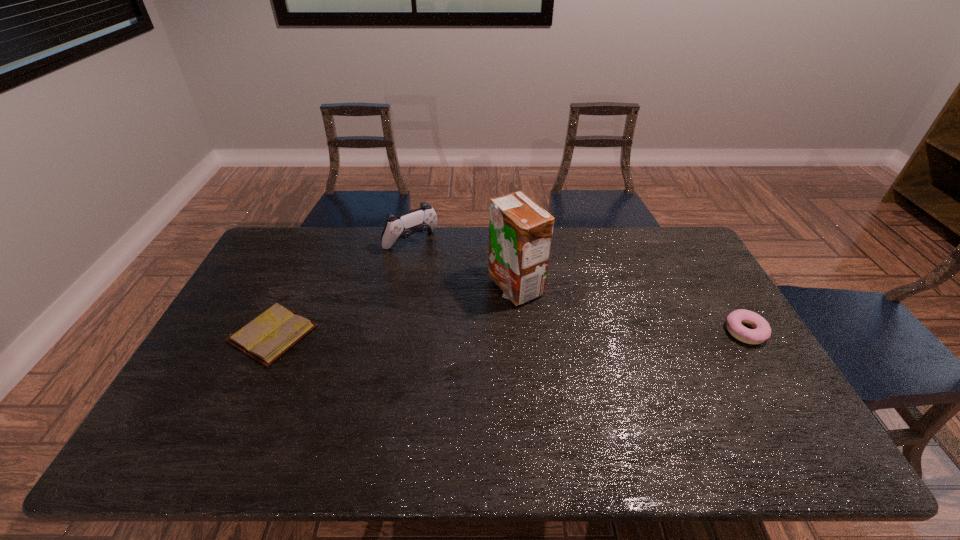
You are a GUI agent. You are given a task and a screenshot of the screen. Output one action in this format:
    pyautogui.click(x=<x>, y=<y>)
    Task: Click on the free region at the far edge of the desktop
    
    Given the screenshot: What is the action you would take?
    pyautogui.click(x=445, y=265)

Find the location of a particular element. vacant region at the near edge of the desktop is located at coordinates 719,416.

The height and width of the screenshot is (540, 960). What are the coordinates of `free region at the left edge of the desktop` in the screenshot? It's located at (216, 330).

In the image, there is a desktop. Where is `free region at the right edge`? free region at the right edge is located at coordinates (709, 355).

Where is `free space at the far right corner`? Image resolution: width=960 pixels, height=540 pixels. free space at the far right corner is located at coordinates (679, 258).

In the image, there is a desktop. At what (x,y) coordinates should I click in order to perform the action: click on free space at the near right corner. Please return your answer as a coordinate pair (x, y). Looking at the image, I should click on coord(786,415).

Where is `vacant space in between the doughnut and the control`? vacant space in between the doughnut and the control is located at coordinates (578, 287).

At what (x,y) coordinates should I click in order to perform the action: click on blank region between the carton and the rightmost object. Please return your answer as a coordinate pair (x, y). Looking at the image, I should click on (630, 309).

Locate an element on the screen. The width and height of the screenshot is (960, 540). empty location between the tallest object and the doughnut is located at coordinates (630, 309).

Where is `vacant area between the second object from right to left and the second tallest object`? The height and width of the screenshot is (540, 960). vacant area between the second object from right to left and the second tallest object is located at coordinates (463, 264).